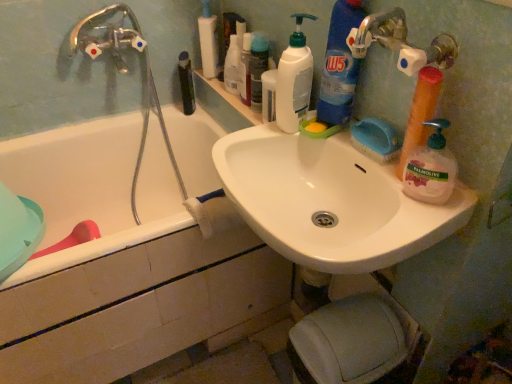
You are a GUI agent. You are given a task and a screenshot of the screen. Output one action in this format:
    pyautogui.click(x=<x>, y=<y>)
    Task: Click on the free space in front of palmolive liquid soap at right, the first cleaning product viewed from the right
    The width and height of the screenshot is (512, 384).
    Given the screenshot: What is the action you would take?
    click(x=416, y=224)